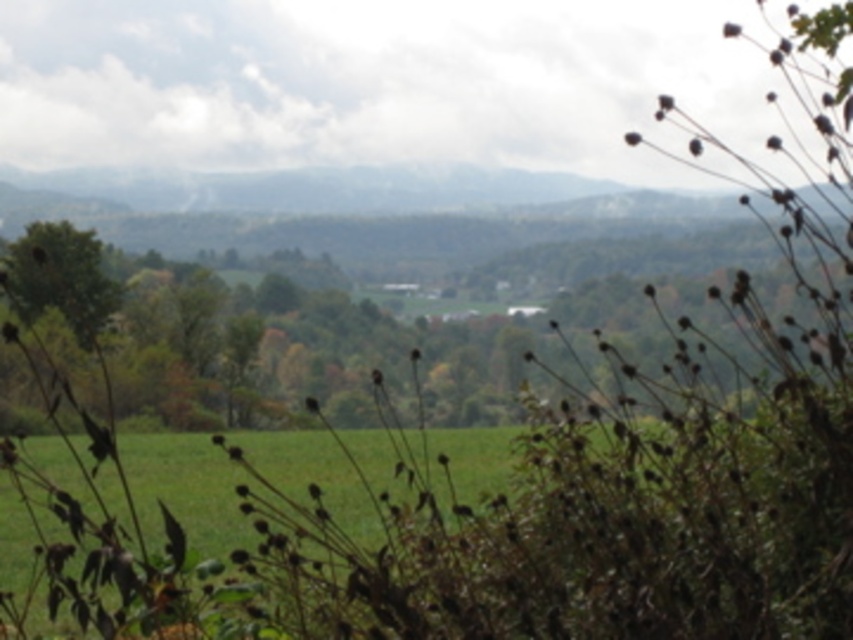
Question: Is green matte tree at center thinner than green grass at center?

Choices:
 (A) yes
 (B) no

Answer: (B)

Question: Among these points, which one is farthest from the camera?

Choices:
 (A) (91, 241)
 (B) (154, 324)
 (C) (368, 506)

Answer: (A)

Question: Can you confirm if green grass at center is wider than green leafy tree at left?

Choices:
 (A) no
 (B) yes

Answer: (A)

Question: Does green matte tree at center appear on the left side of green grass at center?

Choices:
 (A) yes
 (B) no

Answer: (B)

Question: Which object is positioned farthest from the green matte tree at center?

Choices:
 (A) green grass at center
 (B) green leafy tree at left

Answer: (A)

Question: Based on their relative distances, which object is farther from the green matte tree at center?

Choices:
 (A) green leafy tree at left
 (B) green grass at center

Answer: (B)